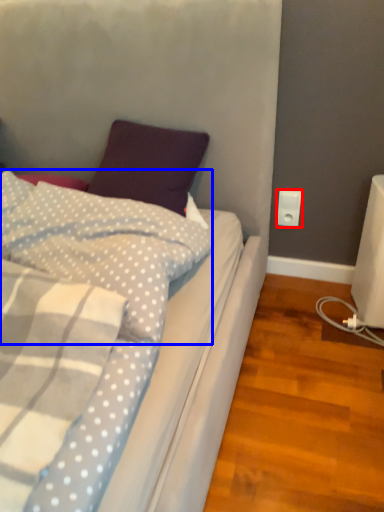
Question: Which object is closer to the camera taking this photo, power plugs and sockets (highlighted by a red box) or pillow (highlighted by a blue box)?

Choices:
 (A) power plugs and sockets
 (B) pillow

Answer: (B)